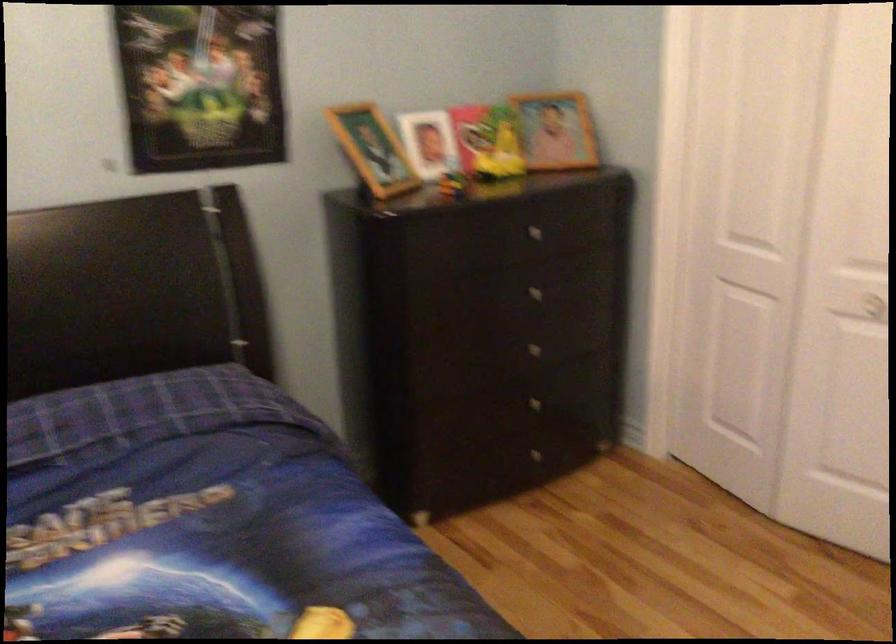
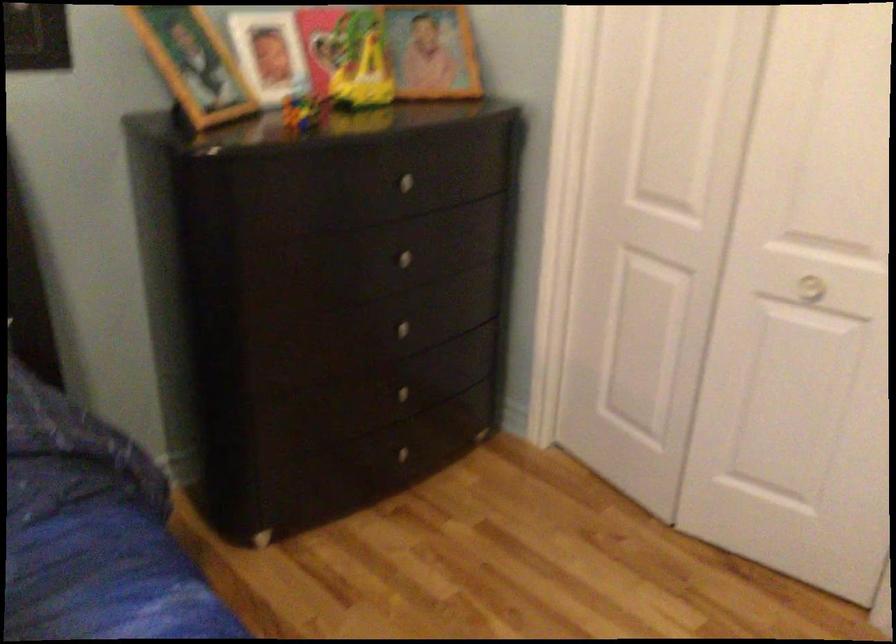
In the second image, find the point that corresponds to [452,178] in the first image.

(303, 111)